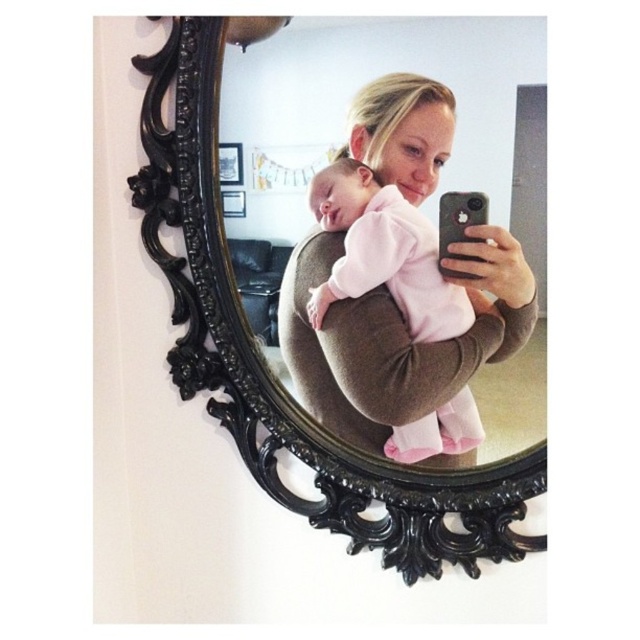
Question: Which point is closer to the camera taking this photo?

Choices:
 (A) (154, 93)
 (B) (328, 296)

Answer: (B)

Question: Is the position of black ornate mirror at center more distant than that of pink soft fabric baby at center?

Choices:
 (A) no
 (B) yes

Answer: (B)

Question: Is black ornate mirror at center smaller than pink soft fabric baby at center?

Choices:
 (A) no
 (B) yes

Answer: (A)

Question: Among these objects, which one is nearest to the camera?

Choices:
 (A) pink soft fabric baby at center
 (B) black ornate mirror at center

Answer: (A)

Question: Can you confirm if black ornate mirror at center is wider than pink soft fabric baby at center?

Choices:
 (A) yes
 (B) no

Answer: (A)